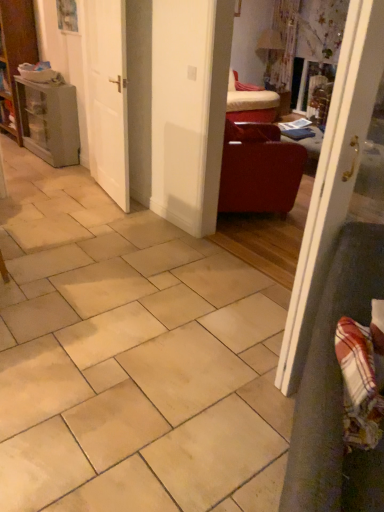
Image resolution: width=384 pixels, height=512 pixels. What are the coordinates of `free point below white matte door at center, the 1th door when ordered from left to right (from a real-world perspective)` in the screenshot? It's located at (107, 198).